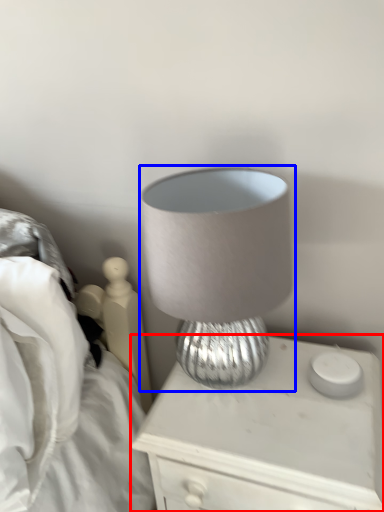
Question: Which object appears closest to the camera in this image, nightstand (highlighted by a red box) or lamp (highlighted by a blue box)?

Choices:
 (A) nightstand
 (B) lamp

Answer: (B)